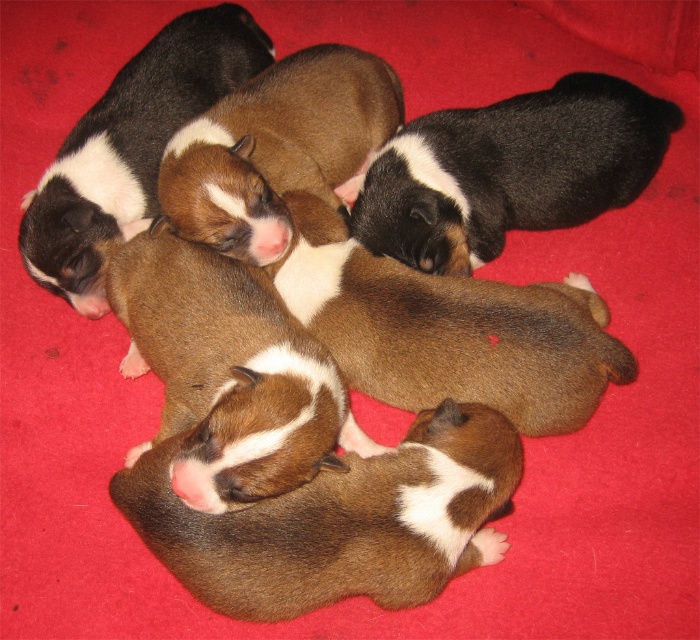
Question: Which object is closer to the camera taking this photo?

Choices:
 (A) black fur puppy at upper right
 (B) brown fuzzy puppy at center
 (C) brown soft fur puppy at center
 (D) brown fur puppy at upper left

Answer: (B)

Question: Is brown fuzzy puppy at center thinner than black fur puppy at upper right?

Choices:
 (A) yes
 (B) no

Answer: (A)

Question: Which point is closer to the camera taking this photo?

Choices:
 (A) (388, 577)
 (B) (228, 228)
 (C) (190, 67)

Answer: (A)

Question: Is brown furry puppy at center bigger than black fur puppy at upper right?

Choices:
 (A) yes
 (B) no

Answer: (B)

Question: Can you confirm if brown furry puppy at center is positioned to the left of brown soft fur puppy at center?

Choices:
 (A) no
 (B) yes

Answer: (A)

Question: Based on their relative distances, which object is farther from the brown fur puppy at upper left?

Choices:
 (A) brown fuzzy puppy at center
 (B) brown furry puppy at center
 (C) brown soft fur puppy at center
 (D) black fur puppy at upper right

Answer: (B)